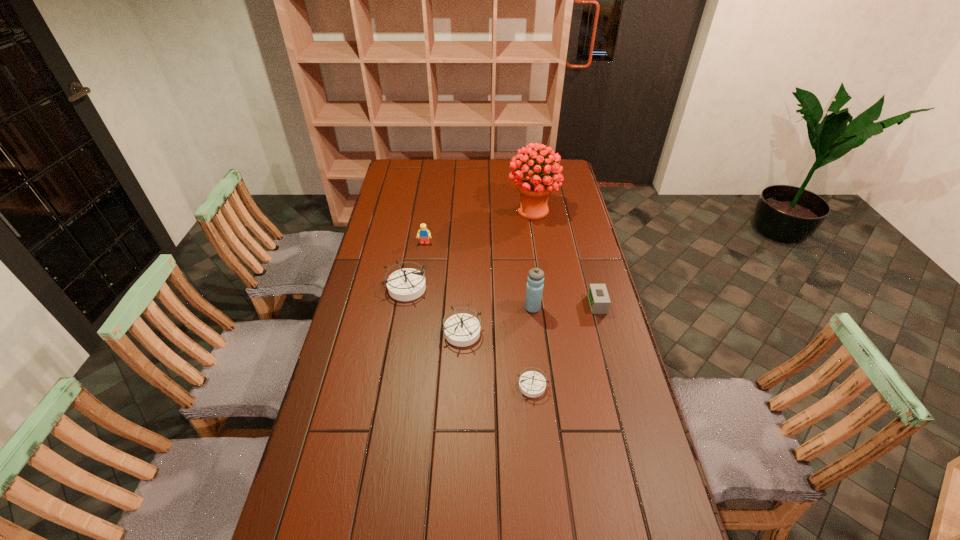
In order to click on bouquet positioned at the right edge in this screenshot , I will do `click(534, 188)`.

This screenshot has width=960, height=540. Identify the location of alarm clock located at the right edge. tap(598, 297).

Identify the location of blank area at the near edge. This screenshot has height=540, width=960. click(x=517, y=523).

In the image, there is a desktop. Where is `free region at the left edge`? Image resolution: width=960 pixels, height=540 pixels. free region at the left edge is located at coordinates (339, 360).

Where is `vacant space at the right edge of the desktop`? vacant space at the right edge of the desktop is located at coordinates (589, 311).

Identify the location of free location at the far left corner of the desktop. The width and height of the screenshot is (960, 540). (415, 160).

What are the coordinates of `vacant point located between the alarm clock and the shortest compass` in the screenshot? It's located at (564, 345).

At what (x,y) coordinates should I click in order to perform the action: click on vacant area that lies between the rightmost compass and the second farthest object. Please return your answer as a coordinate pair (x, y). Image resolution: width=960 pixels, height=540 pixels. Looking at the image, I should click on (478, 314).

This screenshot has height=540, width=960. Identify the location of vacant space in between the farthest compass and the water bottle. (469, 298).

The height and width of the screenshot is (540, 960). Identify the location of free point between the farthest object and the sixth nearest object. (479, 227).